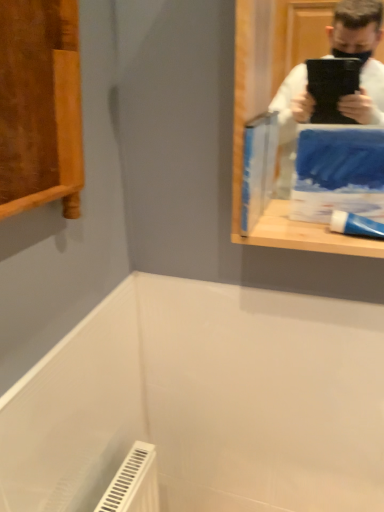
Locate an element on the screen. The width and height of the screenshot is (384, 512). blue paper at upper right, positioned as the second paperback book in right-to-left order is located at coordinates (258, 167).

Locate an element on the screen. The image size is (384, 512). paperback book on the left of the blue matte paperback book at upper right, the second paperback book viewed from the left is located at coordinates (258, 167).

From the picture: Is blue matte paperback book at upper right, the second paperback book viewed from the left, inside blue paper at upper right, marked as the 1th paperback book in a left-to-right arrangement?

No, blue matte paperback book at upper right, the second paperback book viewed from the left, is located outside of blue paper at upper right, marked as the 1th paperback book in a left-to-right arrangement.

Is blue paper at upper right, positioned as the second paperback book in right-to-left order, bigger than blue matte paperback book at upper right, the second paperback book viewed from the left?

Incorrect, blue paper at upper right, positioned as the second paperback book in right-to-left order, is not larger than blue matte paperback book at upper right, the second paperback book viewed from the left.

Which object is further away from the camera taking this photo, blue paper at upper right, marked as the 1th paperback book in a left-to-right arrangement, or blue matte paperback book at upper right, the second paperback book viewed from the left?

blue paper at upper right, marked as the 1th paperback book in a left-to-right arrangement, is further away from the camera.

Between white glossy toothpaste at right and blue matte paperback book at upper right, the 1th paperback book from the right, which one appears on the right side from the viewer's perspective?

blue matte paperback book at upper right, the 1th paperback book from the right.

Does white glossy toothpaste at right contain blue matte paperback book at upper right, the second paperback book viewed from the left?

No, white glossy toothpaste at right does not contain blue matte paperback book at upper right, the second paperback book viewed from the left.

Considering the sizes of objects white glossy toothpaste at right and blue matte paperback book at upper right, the second paperback book viewed from the left, in the image provided, who is shorter, white glossy toothpaste at right or blue matte paperback book at upper right, the second paperback book viewed from the left,?

white glossy toothpaste at right is shorter.

Who is more distant, white glossy toothpaste at right or blue matte paperback book at upper right, the 1th paperback book from the right?

white glossy toothpaste at right is further away from the camera.

What are the coordinates of `toothpaste below the blue paper at upper right, marked as the 1th paperback book in a left-to-right arrangement (from a real-world perspective)` in the screenshot? It's located at (355, 225).

From the picture: How much distance is there between white glossy toothpaste at right and blue paper at upper right, marked as the 1th paperback book in a left-to-right arrangement?

white glossy toothpaste at right is 17.07 centimeters from blue paper at upper right, marked as the 1th paperback book in a left-to-right arrangement.

Is white glossy toothpaste at right next to blue paper at upper right, positioned as the second paperback book in right-to-left order, and touching it?

No, white glossy toothpaste at right is not next to blue paper at upper right, positioned as the second paperback book in right-to-left order.

Is point (381, 223) closer to viewer compared to point (274, 160)?

Yes.

Between blue paper at upper right, positioned as the second paperback book in right-to-left order, and white glossy toothpaste at right, which one has more height?

blue paper at upper right, positioned as the second paperback book in right-to-left order, is taller.

Between blue paper at upper right, positioned as the second paperback book in right-to-left order, and white glossy toothpaste at right, which one has smaller width?

blue paper at upper right, positioned as the second paperback book in right-to-left order, is thinner.

Is blue paper at upper right, marked as the 1th paperback book in a left-to-right arrangement, next to white glossy toothpaste at right and touching it?

No, blue paper at upper right, marked as the 1th paperback book in a left-to-right arrangement, is not making contact with white glossy toothpaste at right.

Consider the image. Which of these two, blue paper at upper right, positioned as the second paperback book in right-to-left order, or white glossy toothpaste at right, is bigger?

Bigger between the two is blue paper at upper right, positioned as the second paperback book in right-to-left order.

Is blue matte paperback book at upper right, the 1th paperback book from the right, turned away from white glossy toothpaste at right?

That's not correct — blue matte paperback book at upper right, the 1th paperback book from the right, is not looking away from white glossy toothpaste at right.

How different are the orientations of blue matte paperback book at upper right, the 1th paperback book from the right, and white glossy toothpaste at right in degrees?

4.62 degrees separate the facing orientations of blue matte paperback book at upper right, the 1th paperback book from the right, and white glossy toothpaste at right.

Is blue matte paperback book at upper right, the 1th paperback book from the right, positioned beyond the bounds of white glossy toothpaste at right?

Yes, blue matte paperback book at upper right, the 1th paperback book from the right, is not within white glossy toothpaste at right.

Is blue matte paperback book at upper right, the second paperback book viewed from the left, smaller than white glossy toothpaste at right?

Actually, blue matte paperback book at upper right, the second paperback book viewed from the left, might be larger than white glossy toothpaste at right.

Is blue matte paperback book at upper right, the 1th paperback book from the right, smaller than blue paper at upper right, positioned as the second paperback book in right-to-left order?

No.

From the image's perspective, which object appears higher, blue matte paperback book at upper right, the 1th paperback book from the right, or blue paper at upper right, marked as the 1th paperback book in a left-to-right arrangement?

blue paper at upper right, marked as the 1th paperback book in a left-to-right arrangement, is shown above in the image.

How distant is blue matte paperback book at upper right, the second paperback book viewed from the left, from blue paper at upper right, positioned as the second paperback book in right-to-left order?

blue matte paperback book at upper right, the second paperback book viewed from the left, is 4.29 inches away from blue paper at upper right, positioned as the second paperback book in right-to-left order.

Is blue matte paperback book at upper right, the second paperback book viewed from the left, taller or shorter than blue paper at upper right, marked as the 1th paperback book in a left-to-right arrangement?

Clearly, blue matte paperback book at upper right, the second paperback book viewed from the left, is shorter compared to blue paper at upper right, marked as the 1th paperback book in a left-to-right arrangement.

Where is `paperback book in front of the blue paper at upper right, marked as the 1th paperback book in a left-to-right arrangement`? The height and width of the screenshot is (512, 384). paperback book in front of the blue paper at upper right, marked as the 1th paperback book in a left-to-right arrangement is located at coordinates (338, 172).

Locate an element on the screen. This screenshot has height=512, width=384. toothpaste below the blue matte paperback book at upper right, the 1th paperback book from the right (from a real-world perspective) is located at coordinates (355, 225).

Which object lies nearer to the anchor point blue paper at upper right, positioned as the second paperback book in right-to-left order, blue matte paperback book at upper right, the second paperback book viewed from the left, or white glossy toothpaste at right?

blue matte paperback book at upper right, the second paperback book viewed from the left, is closer to blue paper at upper right, positioned as the second paperback book in right-to-left order.

When comparing their distances from white glossy toothpaste at right, does blue paper at upper right, positioned as the second paperback book in right-to-left order, or blue matte paperback book at upper right, the second paperback book viewed from the left, seem closer?

blue matte paperback book at upper right, the second paperback book viewed from the left, is positioned closer to the anchor white glossy toothpaste at right.

Based on their spatial positions, is white glossy toothpaste at right or blue matte paperback book at upper right, the second paperback book viewed from the left, closer to blue paper at upper right, positioned as the second paperback book in right-to-left order?

blue matte paperback book at upper right, the second paperback book viewed from the left, is positioned closer to the anchor blue paper at upper right, positioned as the second paperback book in right-to-left order.

Based on their spatial positions, is blue matte paperback book at upper right, the 1th paperback book from the right, or blue paper at upper right, positioned as the second paperback book in right-to-left order, further from white glossy toothpaste at right?

The object further to white glossy toothpaste at right is blue paper at upper right, positioned as the second paperback book in right-to-left order.

Considering their positions, is blue paper at upper right, positioned as the second paperback book in right-to-left order, positioned further to blue matte paperback book at upper right, the 1th paperback book from the right, than white glossy toothpaste at right?

The object further to blue matte paperback book at upper right, the 1th paperback book from the right, is blue paper at upper right, positioned as the second paperback book in right-to-left order.

When comparing their distances from blue matte paperback book at upper right, the 1th paperback book from the right, does white glossy toothpaste at right or blue paper at upper right, marked as the 1th paperback book in a left-to-right arrangement, seem further?

blue paper at upper right, marked as the 1th paperback book in a left-to-right arrangement, is further to blue matte paperback book at upper right, the 1th paperback book from the right.

I want to click on toothpaste between blue paper at upper right, marked as the 1th paperback book in a left-to-right arrangement, and blue matte paperback book at upper right, the second paperback book viewed from the left, from left to right, so click(355, 225).